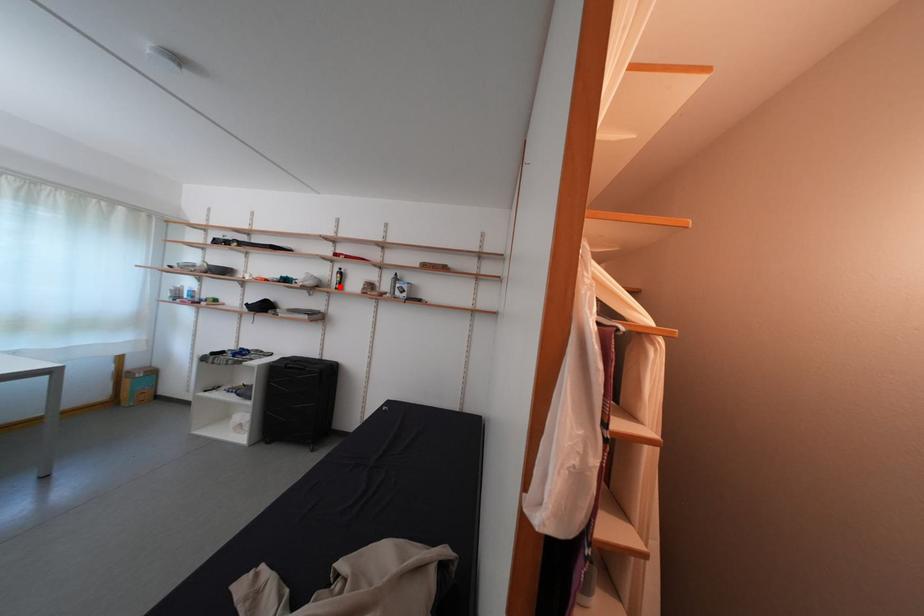
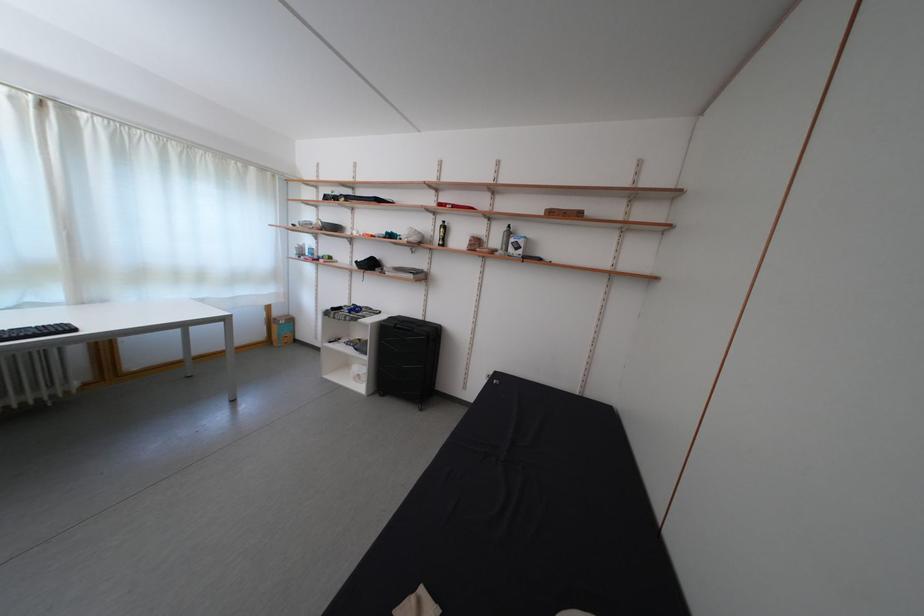
The point at the highlighted location is marked in the first image. Where is the corresponding point in the second image?

(442, 241)